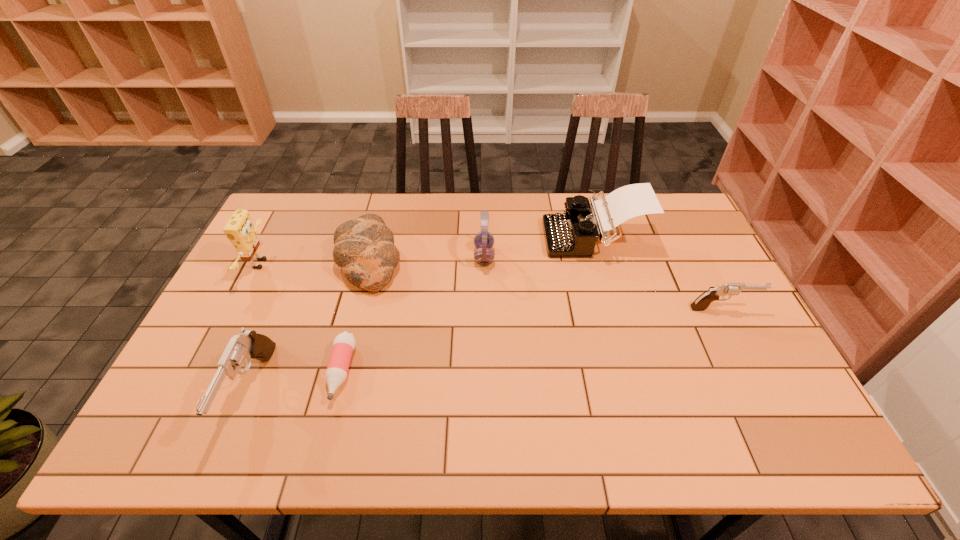
Find the location of a particular element. Image resolution: width=960 pixels, height=540 pixels. the taller gun is located at coordinates (248, 344).

In order to click on the left gun in this screenshot , I will do `click(248, 344)`.

Where is `the third nearest object`? The image size is (960, 540). the third nearest object is located at coordinates (701, 303).

Image resolution: width=960 pixels, height=540 pixels. I want to click on the shorter gun, so click(x=701, y=303).

Where is `typewriter`? The width and height of the screenshot is (960, 540). typewriter is located at coordinates (574, 233).

What are the coordinates of `the fifth object from left to right` in the screenshot? It's located at (484, 240).

I want to click on bread, so click(364, 248).

Find the location of a particular element. The image size is (960, 540). the leftmost object is located at coordinates (240, 230).

Image resolution: width=960 pixels, height=540 pixels. In order to click on bottle in this screenshot , I will do `click(343, 345)`.

Where is `free space located on the keys of the typewriter`? This screenshot has height=540, width=960. free space located on the keys of the typewriter is located at coordinates (523, 237).